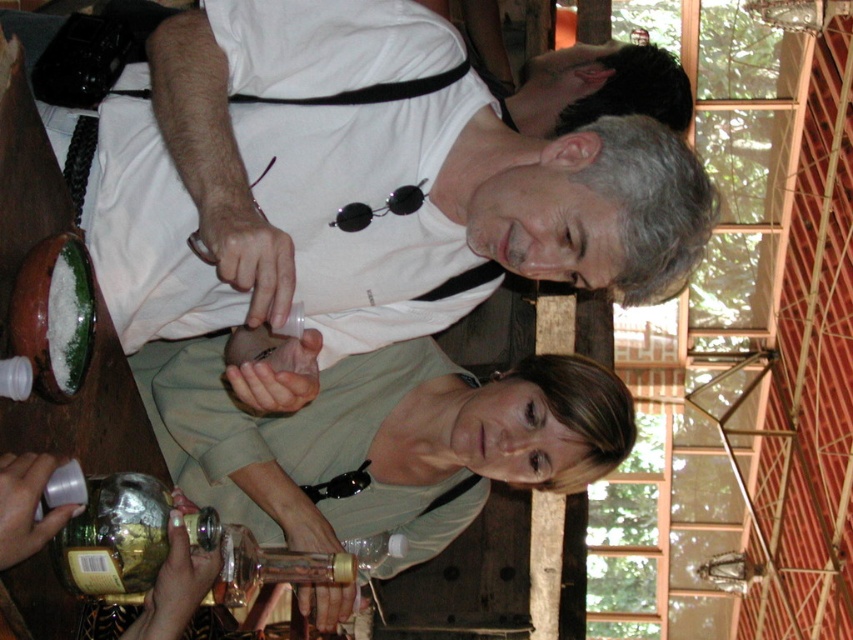
You are a bartender preparing a drink and need to place the white matte shirt at upper center and the shiny metallic bottle at lower left on the bar. What is the minimum distance you should keep between them to ensure they don not touch?

The white matte shirt at upper center and the shiny metallic bottle at lower left are 5.65 feet apart, so you should keep at least 5.65 feet between them to ensure they do not touch.

In the scene shown: Based on the scene described, which of the two shirts, the white matte shirt at upper center or the green matte shirt at center, is larger in size?

The green matte shirt at center is larger than the white matte shirt at upper center.

Where is the green matte shirt at center located in the image?

The green matte shirt at center is located at the 2D coordinates point (x=381, y=440).